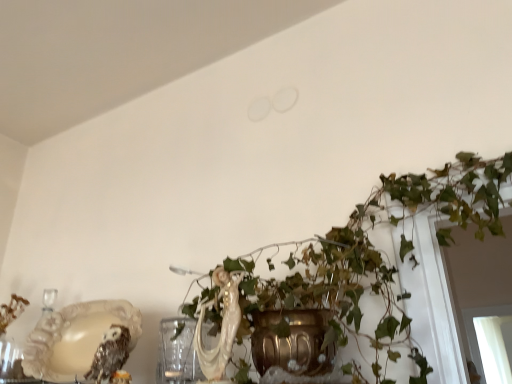
Question: Considering the relative sizes of shiny metallic owl at lower left and white glossy cat at center in the image provided, is shiny metallic owl at lower left bigger than white glossy cat at center?

Choices:
 (A) yes
 (B) no

Answer: (B)

Question: Is shiny metallic owl at lower left facing away from white glossy cat at center?

Choices:
 (A) yes
 (B) no

Answer: (B)

Question: Considering the relative positions of shiny metallic owl at lower left and white glossy cat at center in the image provided, is shiny metallic owl at lower left in front of white glossy cat at center?

Choices:
 (A) no
 (B) yes

Answer: (A)

Question: Is the depth of shiny metallic owl at lower left greater than that of white glossy cat at center?

Choices:
 (A) no
 (B) yes

Answer: (B)

Question: From the image's perspective, is shiny metallic owl at lower left beneath white glossy cat at center?

Choices:
 (A) no
 (B) yes

Answer: (B)

Question: From a real-world perspective, does shiny metallic owl at lower left sit lower than white glossy cat at center?

Choices:
 (A) no
 (B) yes

Answer: (B)

Question: Is shiny metallic owl at lower left at the right side of green leafy plant at center?

Choices:
 (A) yes
 (B) no

Answer: (B)

Question: From the image's perspective, is shiny metallic owl at lower left below green leafy plant at center?

Choices:
 (A) yes
 (B) no

Answer: (A)

Question: Is shiny metallic owl at lower left turned away from green leafy plant at center?

Choices:
 (A) no
 (B) yes

Answer: (A)

Question: Is shiny metallic owl at lower left thinner than green leafy plant at center?

Choices:
 (A) no
 (B) yes

Answer: (B)

Question: Would you consider shiny metallic owl at lower left to be distant from green leafy plant at center?

Choices:
 (A) yes
 (B) no

Answer: (B)

Question: Considering the relative sizes of shiny metallic owl at lower left and green leafy plant at center in the image provided, is shiny metallic owl at lower left bigger than green leafy plant at center?

Choices:
 (A) no
 (B) yes

Answer: (A)

Question: Is green leafy plant at center oriented away from white glossy cat at center?

Choices:
 (A) yes
 (B) no

Answer: (A)